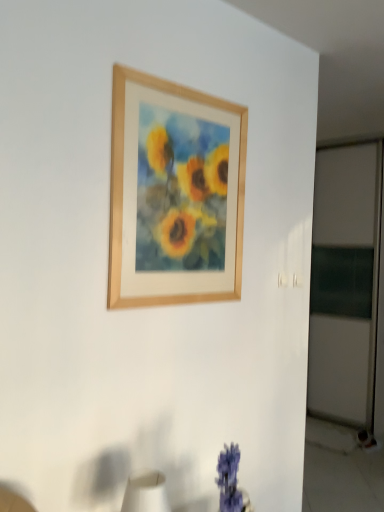
Identify the location of wooden picture frame at upper center. The image size is (384, 512). [174, 194].

What is the approximate width of wooden picture frame at upper center?

The width of wooden picture frame at upper center is 1.27 inches.

The width and height of the screenshot is (384, 512). What do you see at coordinates (174, 194) in the screenshot?
I see `wooden picture frame at upper center` at bounding box center [174, 194].

At what (x,y) coordinates should I click in order to perform the action: click on wooden picture frame at upper center. Please return your answer as a coordinate pair (x, y). Looking at the image, I should click on (174, 194).